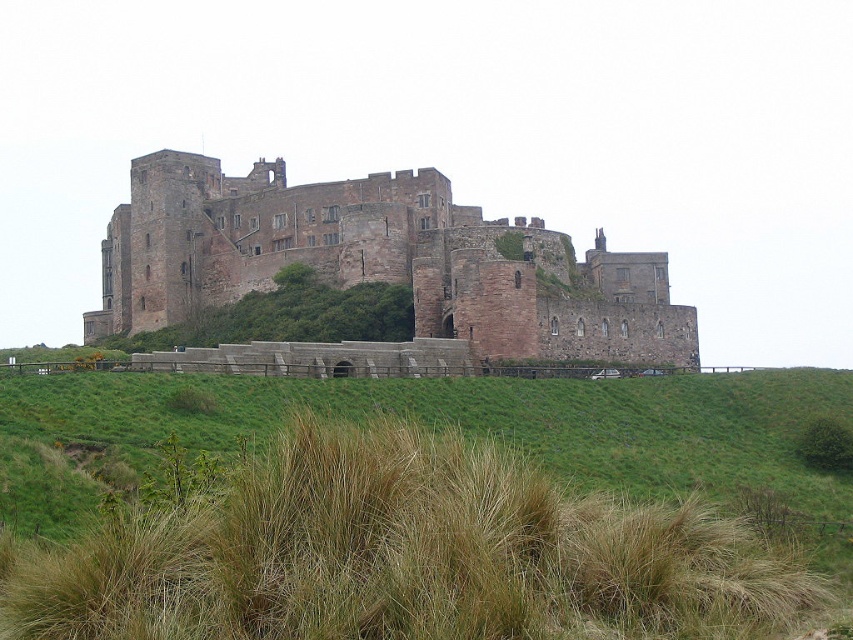
Question: Is brown stone castle at center positioned before green grass at lower center?

Choices:
 (A) no
 (B) yes

Answer: (A)

Question: Does brown stone castle at center have a smaller size compared to green grass at lower center?

Choices:
 (A) yes
 (B) no

Answer: (B)

Question: Which object appears farthest from the camera in this image?

Choices:
 (A) brown stone castle at center
 (B) green grass at lower center

Answer: (A)

Question: Is the position of brown stone castle at center more distant than that of green grass at lower center?

Choices:
 (A) no
 (B) yes

Answer: (B)